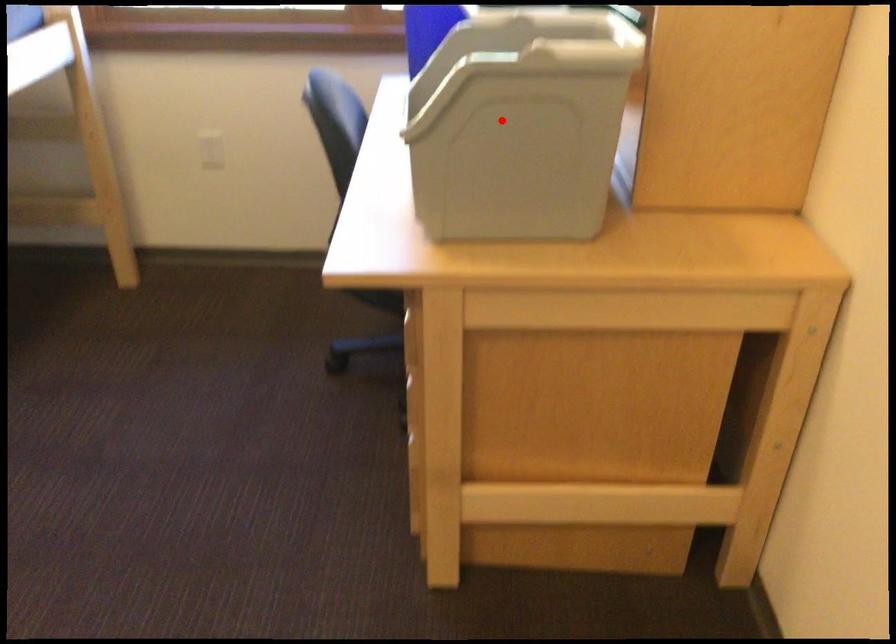
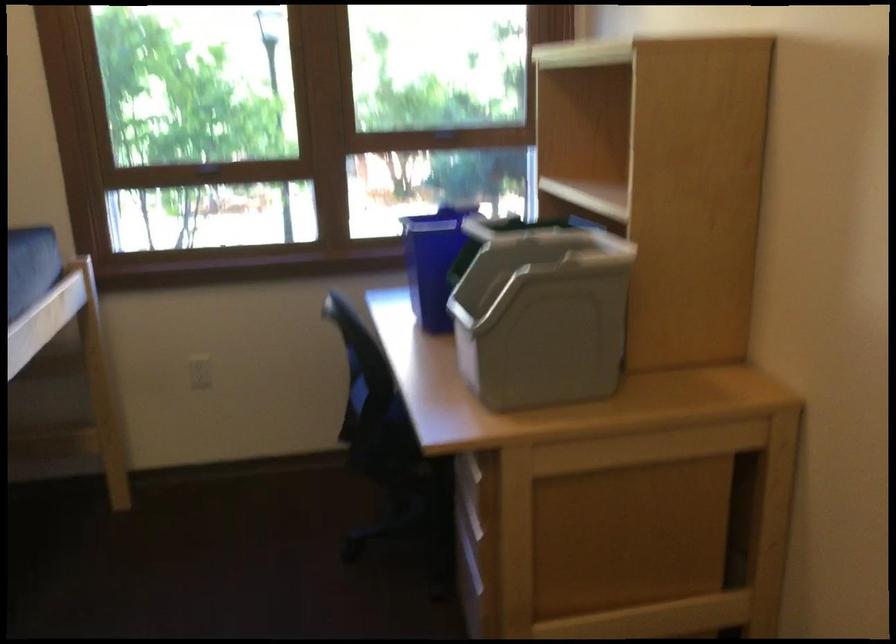
In the second image, find the point that corresponds to the highlighted location in the first image.

(540, 313)